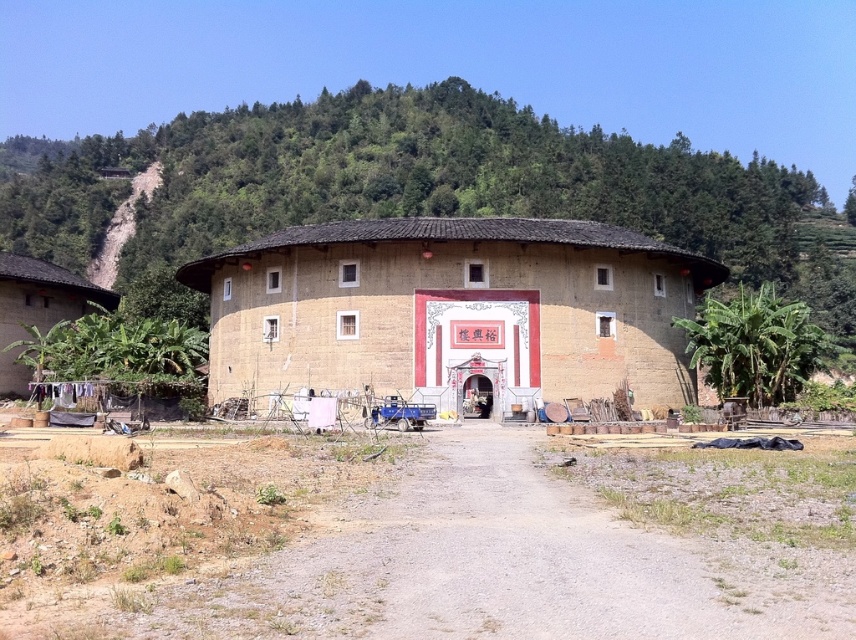
Question: In this image, where is brown clay house at center located relative to matte brown hut at lower left?

Choices:
 (A) above
 (B) below

Answer: (A)

Question: Which point is farther from the camera taking this photo?

Choices:
 (A) (91, 310)
 (B) (569, 136)

Answer: (B)

Question: Which object is closer to the camera taking this photo?

Choices:
 (A) matte brown hut at lower left
 (B) brown clay house at center

Answer: (B)

Question: Can you confirm if earthy clay roundhouse at center is bigger than matte brown hut at lower left?

Choices:
 (A) yes
 (B) no

Answer: (A)

Question: Which point appears farthest from the camera in this image?

Choices:
 (A) (70, 291)
 (B) (333, 252)
 (C) (318, 112)

Answer: (C)

Question: In this image, where is brown clay house at center located relative to earthy clay roundhouse at center?

Choices:
 (A) above
 (B) below

Answer: (A)